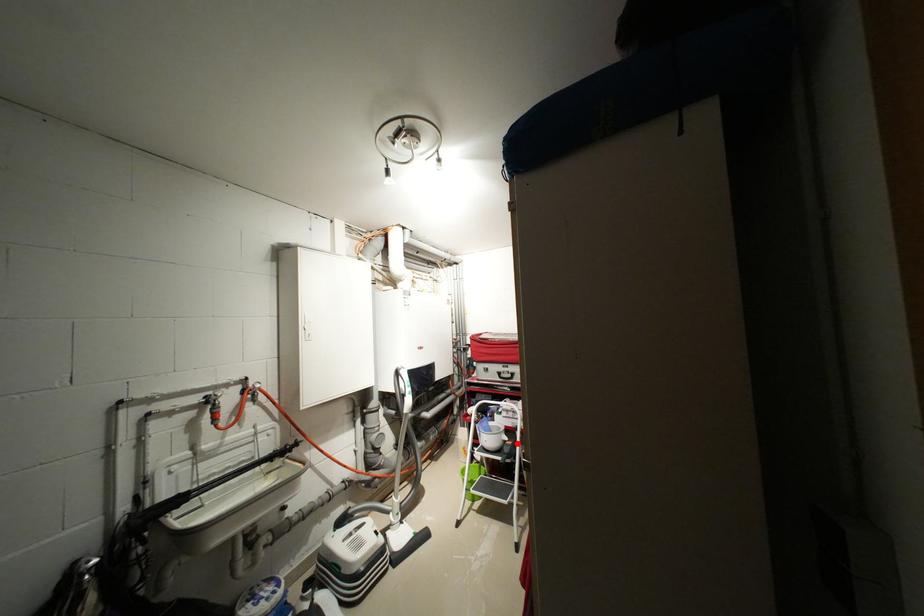
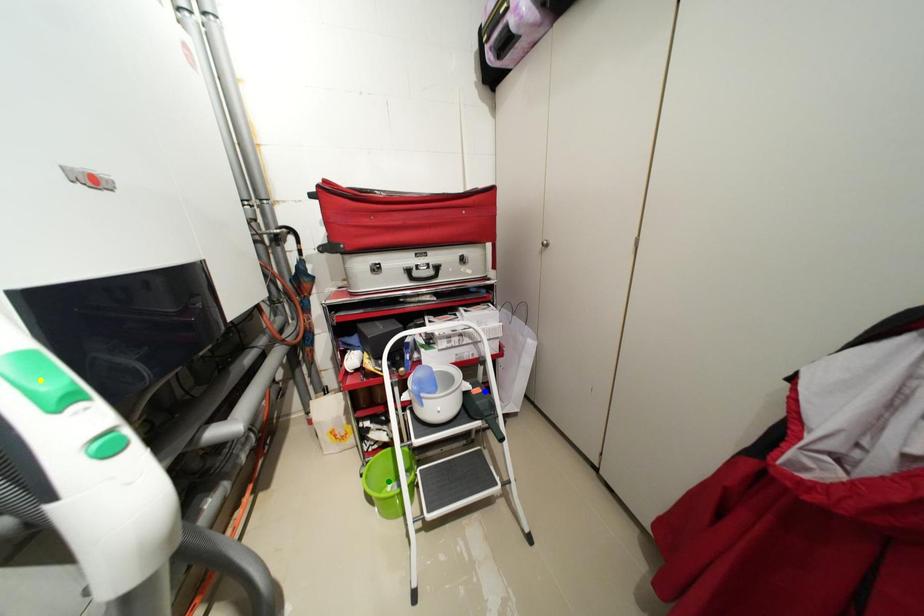
Question: I am providing you with two images of the same scene from different viewpoints. A red point is marked on the first image. You are given multiple points on the second image. Which mark in image 2 goes with the point in image 1?

Choices:
 (A) green point
 (B) blue point
 (C) yellow point

Answer: (B)